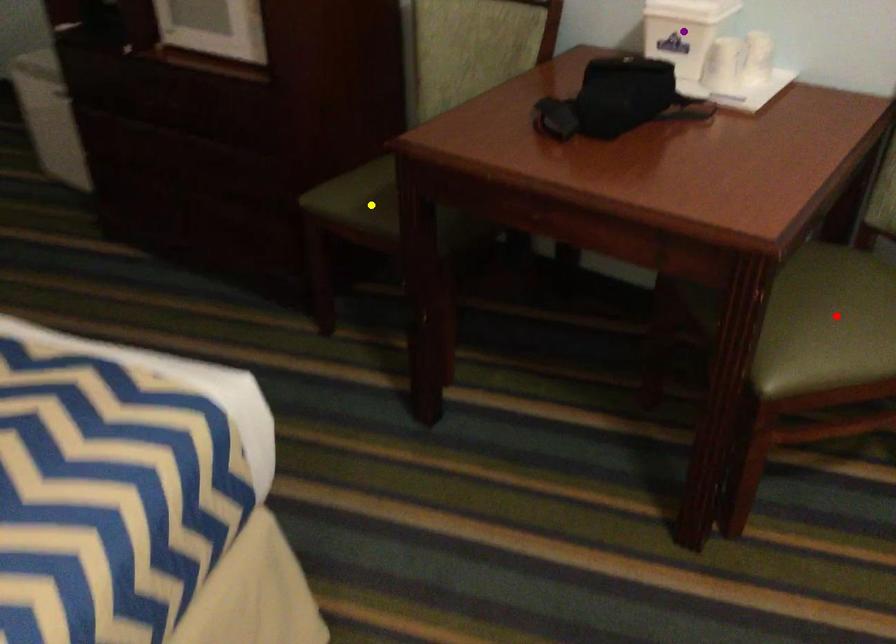
Order these from nearest to farthest:
1. purple point
2. yellow point
3. red point

1. yellow point
2. purple point
3. red point